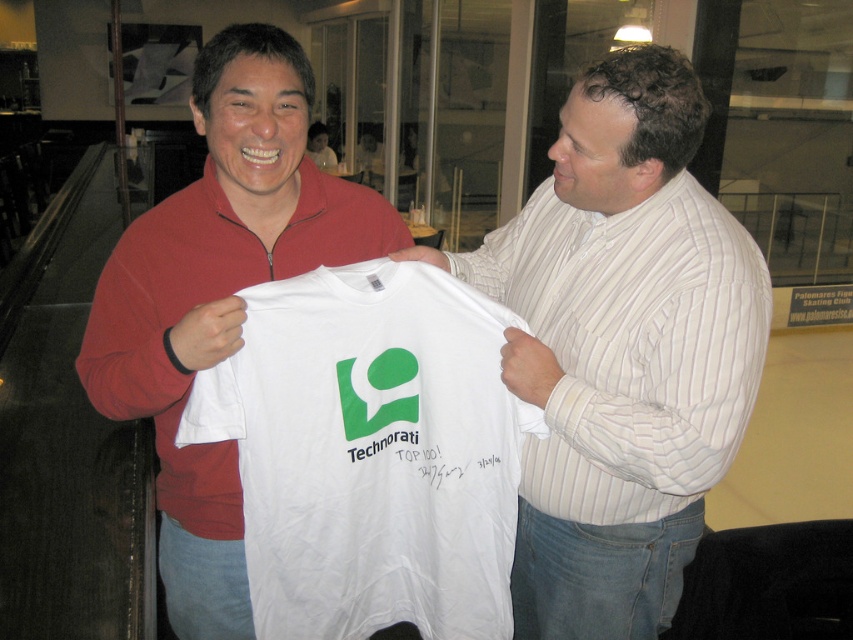
Question: Does white cotton shirt at center appear under white cotton t-shirt at center?

Choices:
 (A) yes
 (B) no

Answer: (B)

Question: Which point is farther from the camera taking this photo?

Choices:
 (A) (421, 616)
 (B) (585, 192)
 (C) (117, 371)

Answer: (A)

Question: Which object is closer to the camera taking this photo?

Choices:
 (A) white cotton t-shirt at center
 (B) white cotton shirt at center

Answer: (A)

Question: Does white cotton shirt at center appear over matte red zip-up sweater at left?

Choices:
 (A) no
 (B) yes

Answer: (A)

Question: Among these points, which one is nearest to the camera?

Choices:
 (A) (198, 595)
 (B) (309, 374)
 (C) (677, 516)

Answer: (B)

Question: Can you confirm if white cotton t-shirt at center is positioned to the right of matte red zip-up sweater at left?

Choices:
 (A) yes
 (B) no

Answer: (A)